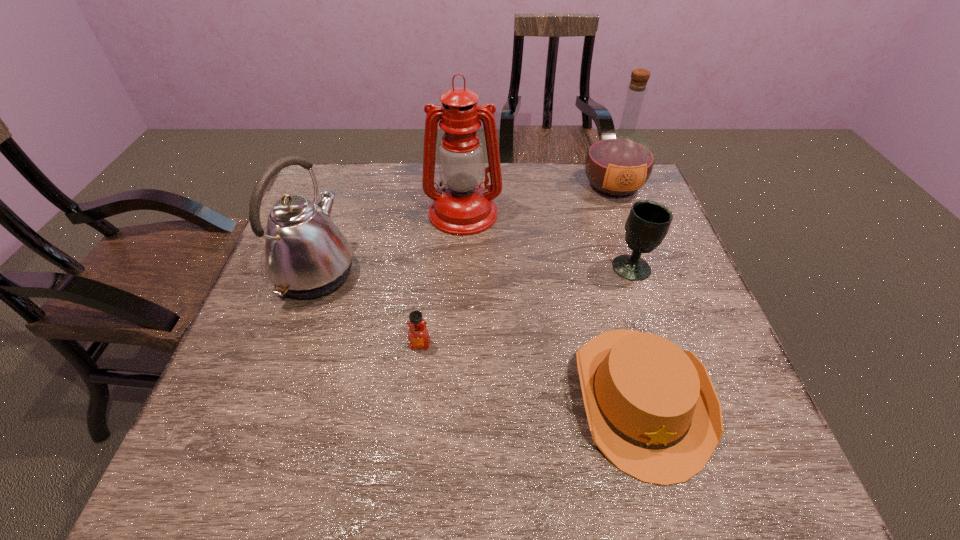
Find the location of `free space located on the front label of the honey`. free space located on the front label of the honey is located at coordinates (410, 435).

Image resolution: width=960 pixels, height=540 pixels. In order to click on oil lamp that is at the far edge in this screenshot , I will do `click(462, 207)`.

I want to click on liquor located at the far edge, so click(618, 163).

Identify the location of object that is positioned at the near edge. The height and width of the screenshot is (540, 960). (652, 409).

The image size is (960, 540). What are the coordinates of `object located in the left edge section of the desktop` in the screenshot? It's located at (306, 256).

Image resolution: width=960 pixels, height=540 pixels. I want to click on liquor that is at the right edge, so click(x=618, y=163).

The width and height of the screenshot is (960, 540). In order to click on chalice located in the right edge section of the desktop in this screenshot , I will do `click(648, 222)`.

Locate an element on the screen. The image size is (960, 540). cowboy hat positioned at the right edge is located at coordinates (652, 409).

Where is `object that is at the far right corner`? This screenshot has height=540, width=960. object that is at the far right corner is located at coordinates (618, 163).

Where is `object that is at the near right corner`? This screenshot has width=960, height=540. object that is at the near right corner is located at coordinates (652, 409).